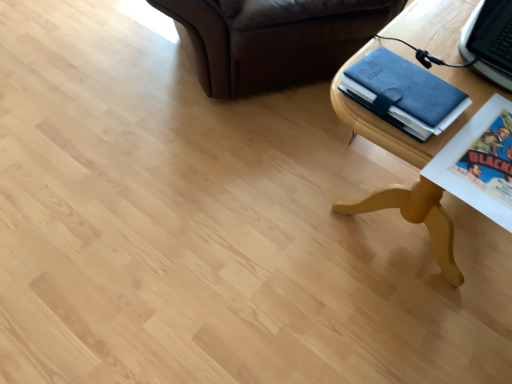
You are a GUI agent. You are given a task and a screenshot of the screen. Output one action in this format:
    pyautogui.click(x=<x>, y=<y>)
    Task: Click on the free spot behind blue leather binder at upper right
    The width and height of the screenshot is (512, 384).
    Given the screenshot: What is the action you would take?
    pyautogui.click(x=422, y=46)